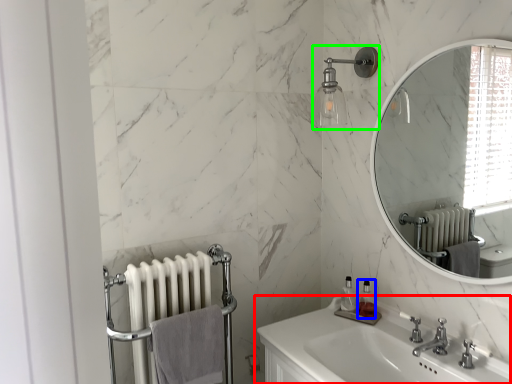
Question: Which is nearer to the sink (highlighted by a red box)? soap dispenser (highlighted by a blue box) or shower (highlighted by a green box).

Choices:
 (A) soap dispenser
 (B) shower

Answer: (A)